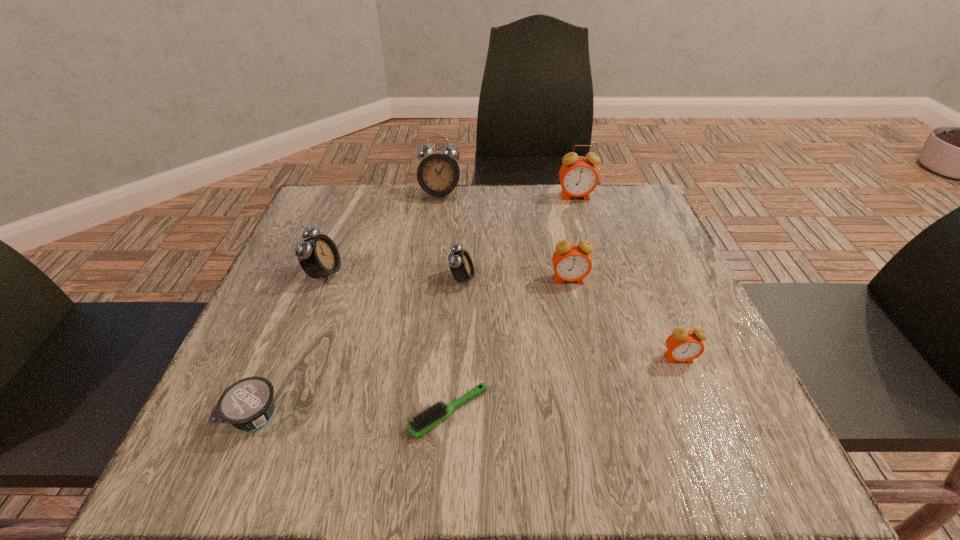
Identify the location of free space that satisfies the following two spatial constraints: 1. on the face of the leftmost alarm clock; 2. on the right side of the hairbrush. The height and width of the screenshot is (540, 960). (273, 412).

Locate an element on the screen. vacant space that satisfies the following two spatial constraints: 1. on the face of the farthest pink alarm clock; 2. on the face of the second smallest white alarm clock is located at coordinates (598, 273).

Image resolution: width=960 pixels, height=540 pixels. Identify the location of vacant space that satisfies the following two spatial constraints: 1. on the back side of the yogurt; 2. on the right side of the hairbrush. (256, 412).

Identify the location of vacant space that satisfies the following two spatial constraints: 1. on the face of the light hairbrush; 2. on the left side of the second biggest white alarm clock. (273, 412).